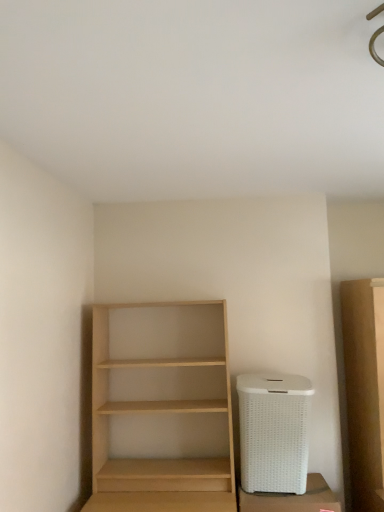
Question: Is white wicker trash can at lower right not within light wood shelf at center?

Choices:
 (A) yes
 (B) no

Answer: (A)

Question: Is white wicker trash can at lower right directly adjacent to light wood shelf at center?

Choices:
 (A) yes
 (B) no

Answer: (B)

Question: Considering the relative positions of white wicker trash can at lower right and light wood shelf at center in the image provided, is white wicker trash can at lower right to the left of light wood shelf at center from the viewer's perspective?

Choices:
 (A) no
 (B) yes

Answer: (A)

Question: Considering the relative sizes of white wicker trash can at lower right and light wood shelf at center in the image provided, is white wicker trash can at lower right smaller than light wood shelf at center?

Choices:
 (A) no
 (B) yes

Answer: (B)

Question: Is light wood shelf at center at the back of white wicker trash can at lower right?

Choices:
 (A) yes
 (B) no

Answer: (B)

Question: Considering the positions of white wicker trash can at lower right and white wicker laundry basket at lower right in the image, is white wicker trash can at lower right wider or thinner than white wicker laundry basket at lower right?

Choices:
 (A) wide
 (B) thin

Answer: (A)

Question: Is point (284, 505) positioned closer to the camera than point (246, 458)?

Choices:
 (A) farther
 (B) closer

Answer: (B)

Question: In the image, is white wicker trash can at lower right positioned in front of or behind white wicker laundry basket at lower right?

Choices:
 (A) behind
 (B) front

Answer: (B)

Question: From the image's perspective, is white wicker trash can at lower right positioned above or below white wicker laundry basket at lower right?

Choices:
 (A) above
 (B) below

Answer: (B)

Question: Considering the positions of white wicker laundry basket at lower right and light wood shelf at center in the image, is white wicker laundry basket at lower right taller or shorter than light wood shelf at center?

Choices:
 (A) short
 (B) tall

Answer: (A)

Question: Is white wicker laundry basket at lower right bigger or smaller than light wood shelf at center?

Choices:
 (A) big
 (B) small

Answer: (B)

Question: Considering their positions, is white wicker laundry basket at lower right located in front of or behind light wood shelf at center?

Choices:
 (A) front
 (B) behind

Answer: (B)

Question: Considering the positions of point (249, 406) and point (155, 498), is point (249, 406) closer or farther from the camera than point (155, 498)?

Choices:
 (A) farther
 (B) closer

Answer: (A)

Question: From their relative heights in the image, would you say light wood shelf at center is taller or shorter than white wicker laundry basket at lower right?

Choices:
 (A) short
 (B) tall

Answer: (B)

Question: In the image, is light wood shelf at center positioned in front of or behind white wicker laundry basket at lower right?

Choices:
 (A) front
 (B) behind

Answer: (A)